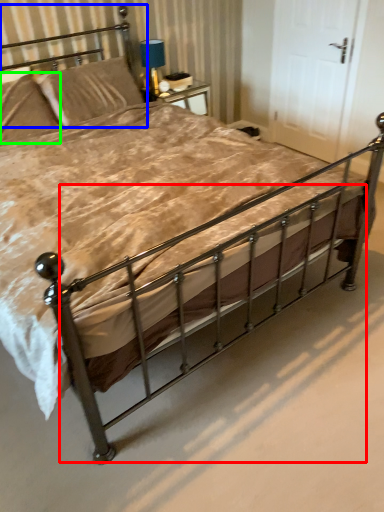
Question: Which object is the closest to the balustrade (highlighted by a red box)? Choose among these: headboard (highlighted by a blue box) or pillow (highlighted by a green box).

Choices:
 (A) headboard
 (B) pillow

Answer: (B)